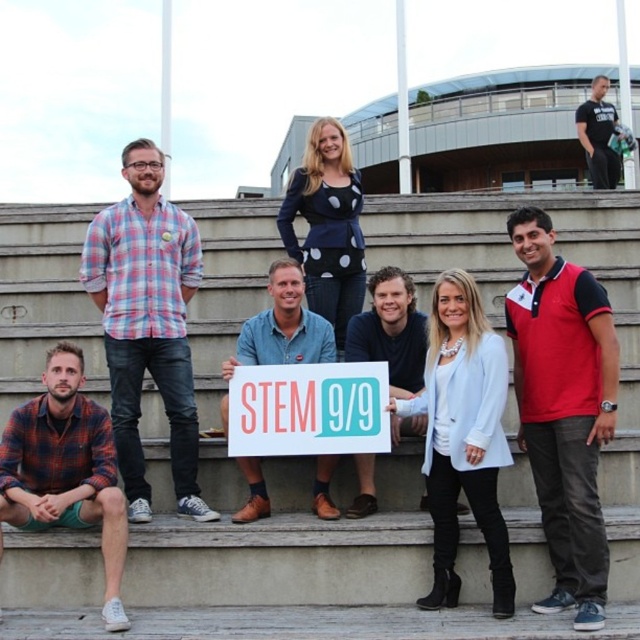
Where is the plaid flannel shirt at lower left located in the image?

The plaid flannel shirt at lower left is located at point (65, 468).

You are taking a photo of the group on the bleachers and want to focus on both point (x=182, y=557) and point (x=547, y=484). Which point should you focus on first to ensure both are in focus?

You should focus on point (x=182, y=557) first because it is closer to the camera than point (x=547, y=484). By focusing on the closer point, the depth of field may extend to include the farther point as well, ensuring both are in focus.